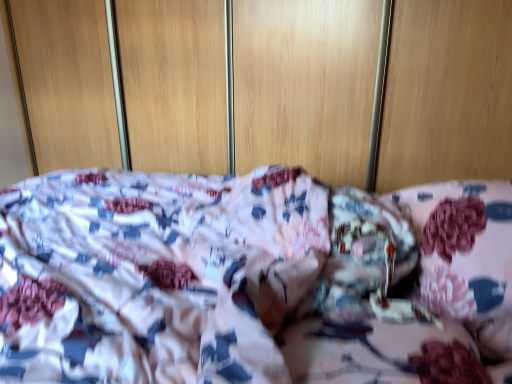
The width and height of the screenshot is (512, 384). Describe the element at coordinates (305, 85) in the screenshot. I see `wooden dresser at center` at that location.

At what (x,y) coordinates should I click in order to perform the action: click on wooden dresser at center. Please return your answer as a coordinate pair (x, y). The width and height of the screenshot is (512, 384). Looking at the image, I should click on (305, 85).

From the picture: Measure the distance between wooden dresser at center and camera.

The distance of wooden dresser at center from camera is 1.75 meters.

The height and width of the screenshot is (384, 512). Describe the element at coordinates (464, 257) in the screenshot. I see `fluffy pink pillow at right` at that location.

What is the approximate width of fluffy pink pillow at right?

fluffy pink pillow at right is 32.38 centimeters in width.

At what (x,y) coordinates should I click in order to perform the action: click on fluffy pink pillow at right. Please return your answer as a coordinate pair (x, y). This screenshot has height=384, width=512. Looking at the image, I should click on (464, 257).

Locate an element on the screen. wooden dresser at center is located at coordinates (305, 85).

Considering the relative positions of wooden dresser at center and fluffy pink pillow at right in the image provided, is wooden dresser at center to the left or to the right of fluffy pink pillow at right?

wooden dresser at center is positioned on fluffy pink pillow at right's left side.

Is wooden dresser at center positioned behind fluffy pink pillow at right?

That is True.

Which is behind, point (424, 3) or point (441, 266)?

The point (424, 3) is behind.

From the image's perspective, which object appears higher, wooden dresser at center or fluffy pink pillow at right?

From the image's view, wooden dresser at center is above.

From a real-world perspective, is wooden dresser at center on top of fluffy pink pillow at right?

Correct, in the physical world, wooden dresser at center is higher than fluffy pink pillow at right.

Can you confirm if wooden dresser at center is thinner than fluffy pink pillow at right?

Correct, the width of wooden dresser at center is less than that of fluffy pink pillow at right.

From their relative heights in the image, would you say wooden dresser at center is taller or shorter than fluffy pink pillow at right?

wooden dresser at center is taller than fluffy pink pillow at right.

In terms of size, does wooden dresser at center appear bigger or smaller than fluffy pink pillow at right?

wooden dresser at center is bigger than fluffy pink pillow at right.

Is wooden dresser at center outside of fluffy pink pillow at right?

Yes.

Is wooden dresser at center positioned far away from fluffy pink pillow at right?

Yes, wooden dresser at center is far from fluffy pink pillow at right.

Is wooden dresser at center aimed at fluffy pink pillow at right?

Yes, wooden dresser at center is turned towards fluffy pink pillow at right.

In order to click on dresser behind the fluffy pink pillow at right in this screenshot , I will do `click(305, 85)`.

Is fluffy pink pillow at right to the right of wooden dresser at center from the viewer's perspective?

Yes.

Which object is closer to the camera, fluffy pink pillow at right or wooden dresser at center?

Positioned in front is fluffy pink pillow at right.

Does point (476, 192) lie in front of point (152, 123)?

Yes, it is in front of point (152, 123).

From the image's perspective, is fluffy pink pillow at right on wooden dresser at center?

No.

From a real-world perspective, relative to wooden dresser at center, is fluffy pink pillow at right vertically above or below?

fluffy pink pillow at right is situated lower than wooden dresser at center in the real world.

Considering the sizes of objects fluffy pink pillow at right and wooden dresser at center in the image provided, who is thinner, fluffy pink pillow at right or wooden dresser at center?

With smaller width is wooden dresser at center.

Can you confirm if fluffy pink pillow at right is taller than wooden dresser at center?

In fact, fluffy pink pillow at right may be shorter than wooden dresser at center.

Between fluffy pink pillow at right and wooden dresser at center, which one has larger size?

With larger size is wooden dresser at center.

Is wooden dresser at center inside fluffy pink pillow at right?

That's incorrect, wooden dresser at center is not inside fluffy pink pillow at right.

Is the surface of fluffy pink pillow at right in direct contact with wooden dresser at center?

No, fluffy pink pillow at right is not next to wooden dresser at center.

Could you tell me if fluffy pink pillow at right is turned towards wooden dresser at center?

No, fluffy pink pillow at right does not turn towards wooden dresser at center.

How much distance is there between fluffy pink pillow at right and wooden dresser at center?

fluffy pink pillow at right and wooden dresser at center are 4.95 feet apart from each other.

Where is `pillow below the wooden dresser at center (from the image's perspective)`? The height and width of the screenshot is (384, 512). pillow below the wooden dresser at center (from the image's perspective) is located at coordinates (464, 257).

The width and height of the screenshot is (512, 384). In order to click on pillow below the wooden dresser at center (from the image's perspective) in this screenshot , I will do `click(464, 257)`.

At what (x,y) coordinates should I click in order to perform the action: click on pillow located on the right of wooden dresser at center. Please return your answer as a coordinate pair (x, y). The width and height of the screenshot is (512, 384). Looking at the image, I should click on (464, 257).